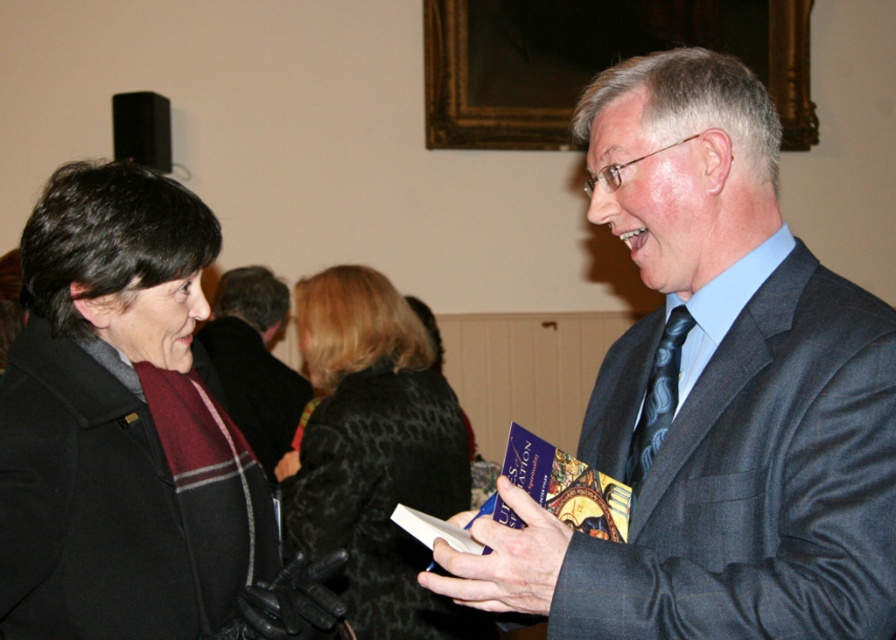
Question: From the image, what is the correct spatial relationship of dark gray suit at center in relation to dark gray suit at right?

Choices:
 (A) right
 (B) left

Answer: (A)

Question: Which point is closer to the camera?

Choices:
 (A) (401, 301)
 (B) (244, 289)
 (C) (762, 284)

Answer: (C)

Question: Which of these objects is positioned closest to the dark gray suit at center?

Choices:
 (A) black textured coat at center
 (B) dark gray suit at right

Answer: (A)

Question: Where is black textured coat at center located in relation to dark gray suit at right in the image?

Choices:
 (A) left
 (B) right

Answer: (B)

Question: Does black textured coat at center have a larger size compared to dark gray suit at right?

Choices:
 (A) yes
 (B) no

Answer: (A)

Question: Which point is closer to the camera?

Choices:
 (A) black textured coat at center
 (B) dark gray suit at center

Answer: (B)